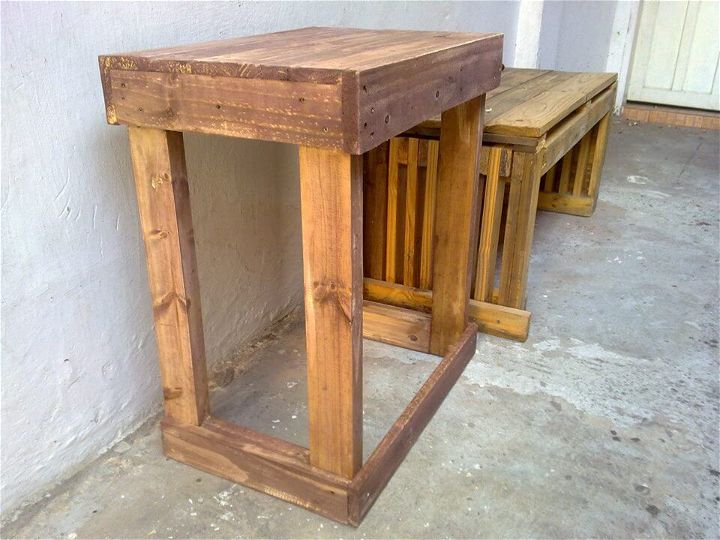
This screenshot has width=720, height=540. Find the location of `white wall`. white wall is located at coordinates (553, 36).